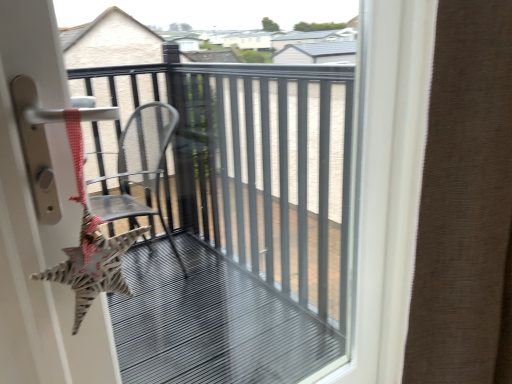
Question: Is metallic gray chair at center bigger or smaller than brown textured curtain at right?

Choices:
 (A) big
 (B) small

Answer: (B)

Question: Is metallic gray chair at center inside or outside of brown textured curtain at right?

Choices:
 (A) inside
 (B) outside

Answer: (B)

Question: From the image's perspective, is metallic gray chair at center positioned above or below brown textured curtain at right?

Choices:
 (A) above
 (B) below

Answer: (B)

Question: From a real-world perspective, is brown textured curtain at right positioned above or below metallic gray chair at center?

Choices:
 (A) above
 (B) below

Answer: (A)

Question: Considering their positions, is brown textured curtain at right located in front of or behind metallic gray chair at center?

Choices:
 (A) behind
 (B) front

Answer: (B)

Question: Considering the positions of brown textured curtain at right and metallic gray chair at center in the image, is brown textured curtain at right wider or thinner than metallic gray chair at center?

Choices:
 (A) thin
 (B) wide

Answer: (B)

Question: Is brown textured curtain at right taller or shorter than metallic gray chair at center?

Choices:
 (A) short
 (B) tall

Answer: (A)